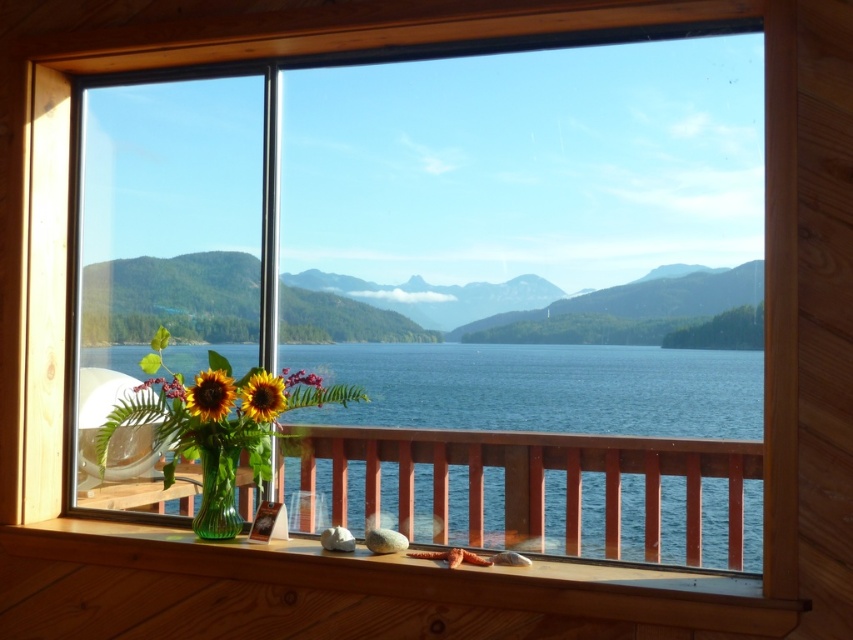
Is green glass vase at lower left thinner than matte glass sunflower at center?

Correct, green glass vase at lower left's width is less than matte glass sunflower at center's.

Find the location of a particular element. The height and width of the screenshot is (640, 853). green glass vase at lower left is located at coordinates (218, 496).

Is point (222, 467) positioned after point (219, 419)?

Yes.

You are a GUI agent. You are given a task and a screenshot of the screen. Output one action in this format:
    pyautogui.click(x=<x>, y=<y>)
    Task: Click on the green glass vase at lower left
    
    Given the screenshot: What is the action you would take?
    pyautogui.click(x=218, y=496)

Does sunflower matte at center have a greater height compared to sunflower matte at lower left?

Indeed, sunflower matte at center has a greater height compared to sunflower matte at lower left.

Where is `sunflower matte at center`? The width and height of the screenshot is (853, 640). sunflower matte at center is located at coordinates (262, 396).

Which is in front, point (202, 461) or point (167, 385)?

Point (202, 461)

The height and width of the screenshot is (640, 853). Find the location of `green glass vase at lower left`. green glass vase at lower left is located at coordinates (218, 496).